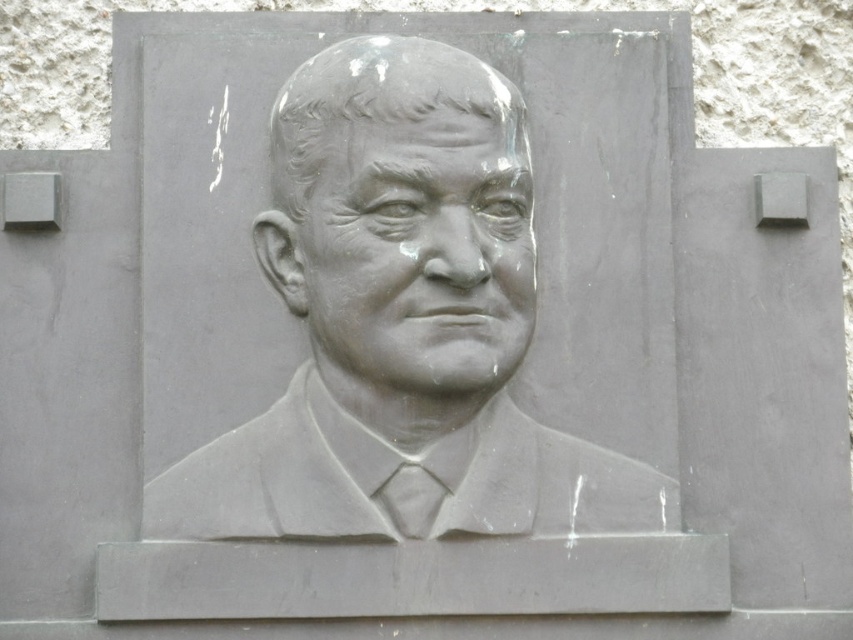
Can you confirm if gray stone relief at center is bigger than gray stone face at center?

Correct, gray stone relief at center is larger in size than gray stone face at center.

Looking at this image, is gray stone relief at center smaller than gray stone face at center?

No.

Identify the location of gray stone relief at center. This screenshot has width=853, height=640. (408, 294).

Locate an element on the screen. The height and width of the screenshot is (640, 853). gray stone relief at center is located at coordinates (x=408, y=294).